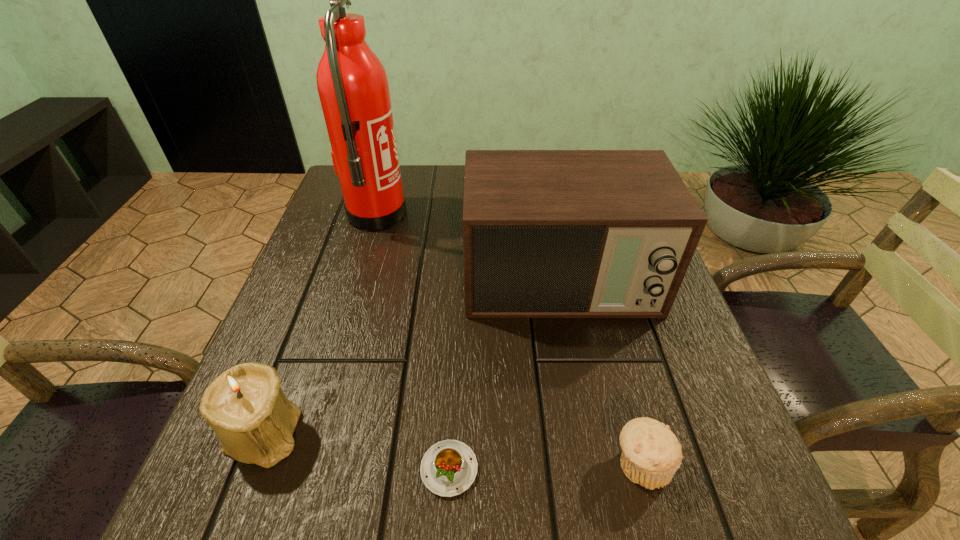
This screenshot has height=540, width=960. Find the location of `the farthest object`. the farthest object is located at coordinates (353, 87).

Where is `the tallest object`? The width and height of the screenshot is (960, 540). the tallest object is located at coordinates (353, 87).

Identify the location of radio receiver. (546, 233).

The width and height of the screenshot is (960, 540). I want to click on the fourth shortest object, so pos(546,233).

Where is `candle_holder`? The width and height of the screenshot is (960, 540). candle_holder is located at coordinates (245, 405).

This screenshot has width=960, height=540. I want to click on muffin, so click(651, 454).

Locate an element on the screen. The height and width of the screenshot is (540, 960). pudding is located at coordinates (449, 467).

This screenshot has height=540, width=960. I want to click on free space located 0.090m on the label side of the tallest object, so click(x=443, y=216).

Where is `vacant space located on the front-facing side of the radio receiver`? vacant space located on the front-facing side of the radio receiver is located at coordinates coord(579,384).

Locate an element on the screen. The height and width of the screenshot is (540, 960). free point located on the back of the third shortest object is located at coordinates click(x=286, y=374).